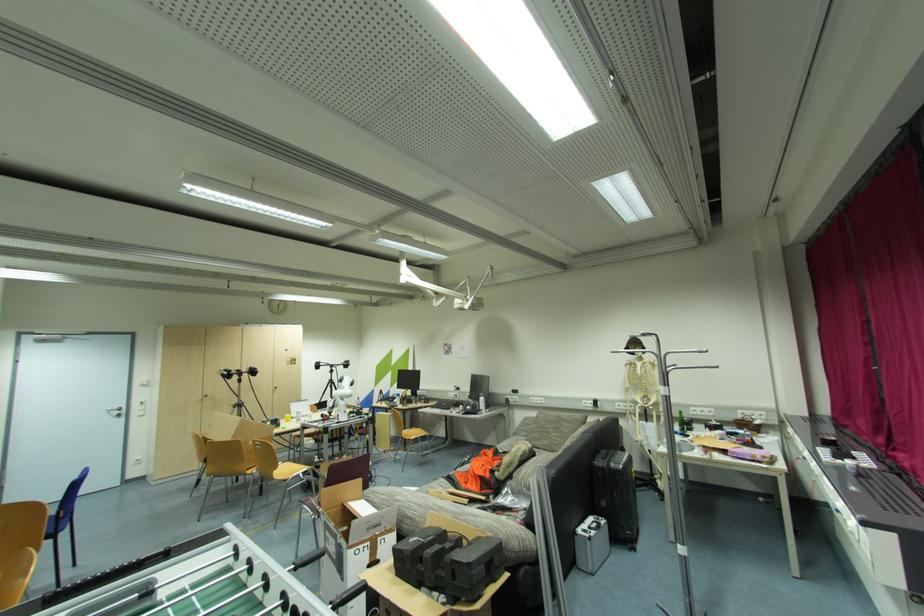
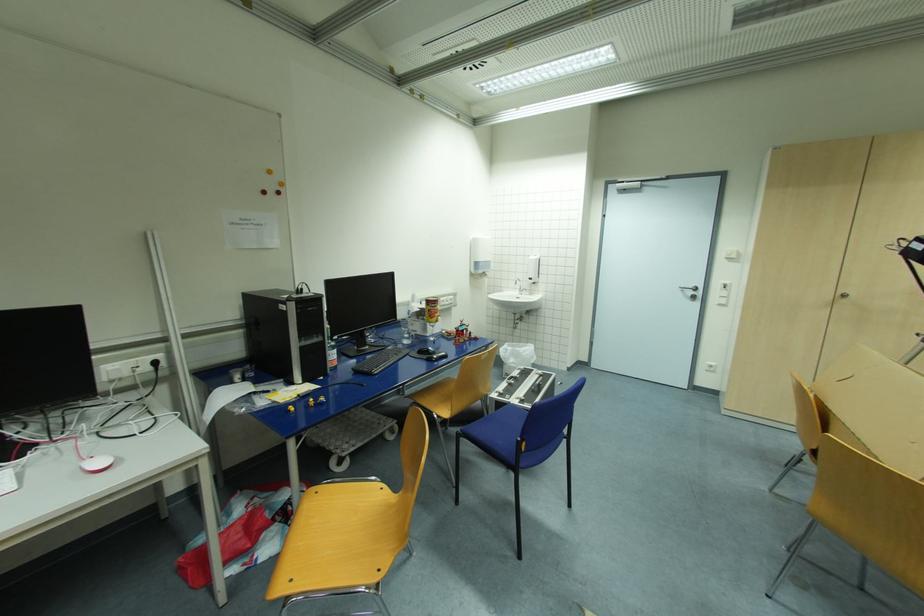
Find the pixel in the second image that matches pixel 124 408 in the first image.

(699, 289)